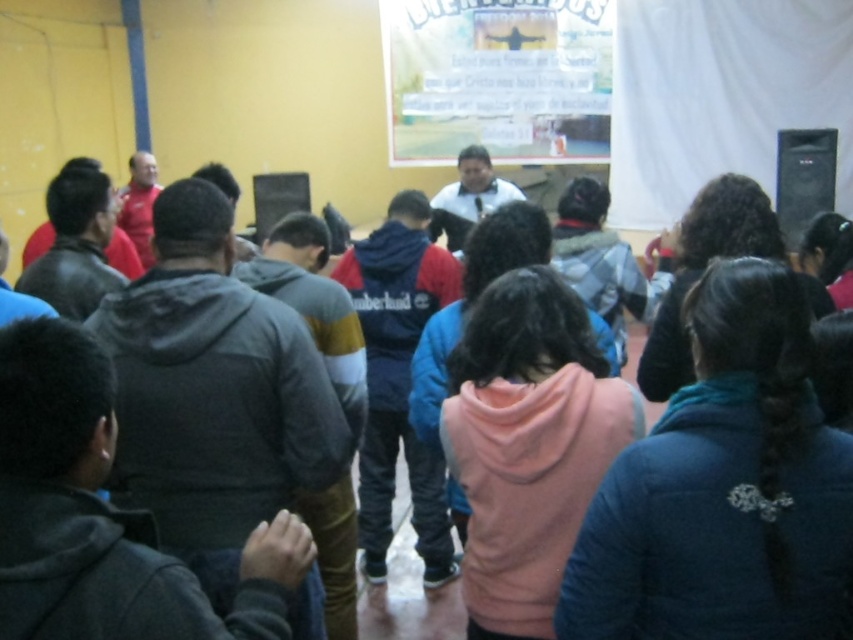
Can you confirm if red fleece hoodie at center is positioned above black matte speaker at upper right?

No.

Which of these two, red fleece hoodie at center or black matte speaker at upper right, stands shorter?

With less height is black matte speaker at upper right.

This screenshot has width=853, height=640. What do you see at coordinates (398, 380) in the screenshot? I see `red fleece hoodie at center` at bounding box center [398, 380].

Find the location of a particular element. The width and height of the screenshot is (853, 640). red fleece hoodie at center is located at coordinates (398, 380).

Is blue fleece jacket at center behind red fleece hoodie at center?

That is False.

Between blue fleece jacket at center and red fleece hoodie at center, which one appears on the right side from the viewer's perspective?

blue fleece jacket at center is more to the right.

Where is `blue fleece jacket at center`? This screenshot has width=853, height=640. blue fleece jacket at center is located at coordinates (724, 486).

Can you confirm if blue fleece jacket at center is positioned above black matte speaker at upper right?

No, blue fleece jacket at center is not above black matte speaker at upper right.

Looking at this image, is blue fleece jacket at center further to camera compared to black matte speaker at upper right?

No, it is not.

Between point (631, 472) and point (799, 152), which one is positioned behind?

Positioned behind is point (799, 152).

The image size is (853, 640). Identify the location of blue fleece jacket at center. (724, 486).